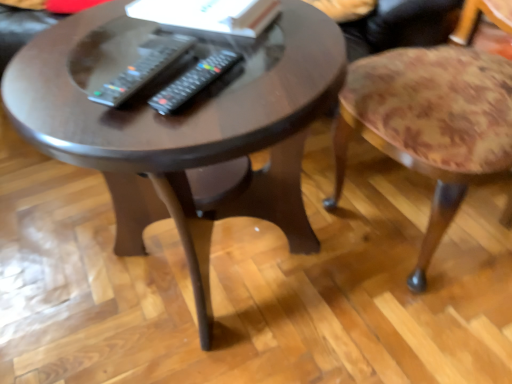
This screenshot has height=384, width=512. I want to click on empty space that is to the right of black plastic remote at center, acting as the 1th remote starting from the right, so click(291, 67).